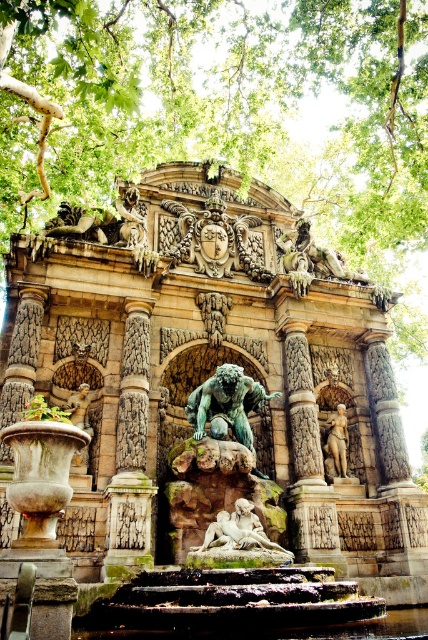
Consider the image. You are standing in the park and want to take a photo of both the green leafy tree at upper center and the polished stone statue at center. Which object should you position to your left side in the camera frame to include both in the photo?

The green leafy tree at upper center is to the left of the polished stone statue at center, so you should position the green leafy tree at upper center to your left side in the camera frame to include both in the photo.

You are standing in the park and want to take a photo of the grand ornate fountain. To frame the shot perfectly, you need to position yourself so that the green leafy tree at upper center is exactly at the top edge of your camera viewfinder. Where should you position yourself relative to the fountain?

Since the green leafy tree at upper center is located at point 0.177 on the x and 0.582 on the y coordinates, positioning yourself to the left side of the fountain and slightly below the tree will ensure the tree is at the top edge of your camera viewfinder.

Based on the photo, you are standing at the base of the grand fountain and want to locate two specific points marked on the fountain structure. The first point is at coordinates point (77, 472) and the second is at point (240, 413). From your current position, which point is closer to you?

Point (77, 472) is in front of point (240, 413), so the first point is closer to you.